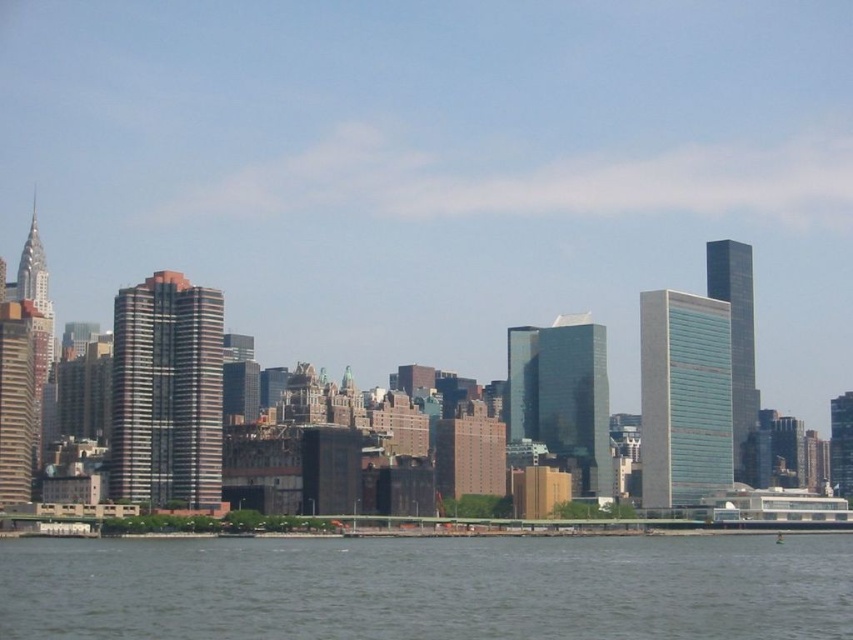
Question: Does gray water at lower center lie behind white glossy boat at lower right?

Choices:
 (A) yes
 (B) no

Answer: (B)

Question: From the image, what is the correct spatial relationship of gray water at lower center in relation to white glossy boat at lower right?

Choices:
 (A) below
 (B) above

Answer: (B)

Question: Which object is closer to the camera taking this photo?

Choices:
 (A) gray water at lower center
 (B) white glossy boat at lower right

Answer: (A)

Question: Which of the following is the closest to the observer?

Choices:
 (A) gray water at lower center
 (B) white glossy boat at lower right

Answer: (A)

Question: Is gray water at lower center above white glossy boat at lower right?

Choices:
 (A) no
 (B) yes

Answer: (B)

Question: Which point appears farthest from the camera in this image?

Choices:
 (A) (16, 570)
 (B) (735, 500)

Answer: (B)